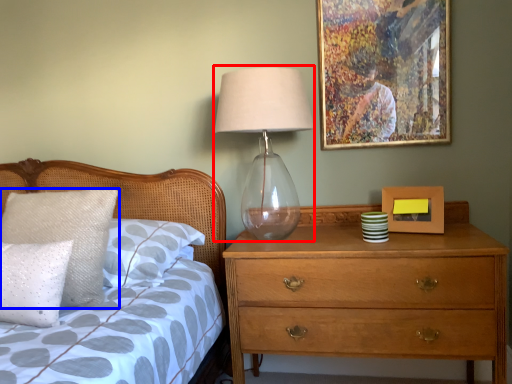
Question: Which of the following is the farthest to the observer, table lamp (highlighted by a red box) or pillow (highlighted by a blue box)?

Choices:
 (A) table lamp
 (B) pillow

Answer: (A)